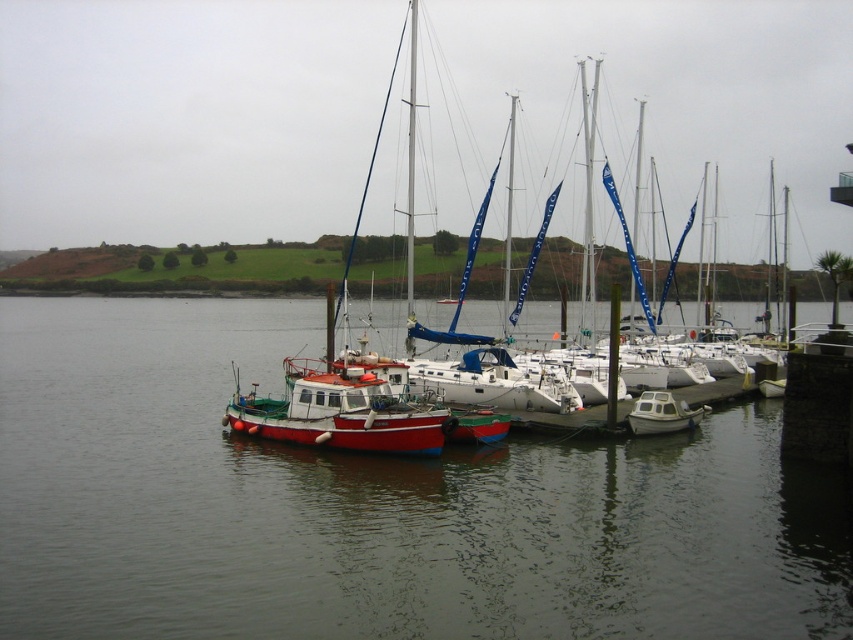
Question: Which object is farther from the camera taking this photo?

Choices:
 (A) white plastic dinghy at lower right
 (B) smooth water at center
 (C) red matte fishing boat at center

Answer: (A)

Question: Is red matte fishing boat at center smaller than white plastic dinghy at lower right?

Choices:
 (A) yes
 (B) no

Answer: (A)

Question: Estimate the real-world distances between objects in this image. Which object is farther from the white plastic dinghy at lower right?

Choices:
 (A) red matte fishing boat at center
 (B) smooth water at center

Answer: (A)

Question: Which point appears closest to the camera in this image?

Choices:
 (A) click(x=367, y=435)
 (B) click(x=79, y=349)
 (C) click(x=669, y=413)

Answer: (A)

Question: Is red matte fishing boat at center further to camera compared to white plastic dinghy at lower right?

Choices:
 (A) yes
 (B) no

Answer: (B)

Question: Is smooth water at center smaller than red matte fishing boat at center?

Choices:
 (A) yes
 (B) no

Answer: (B)